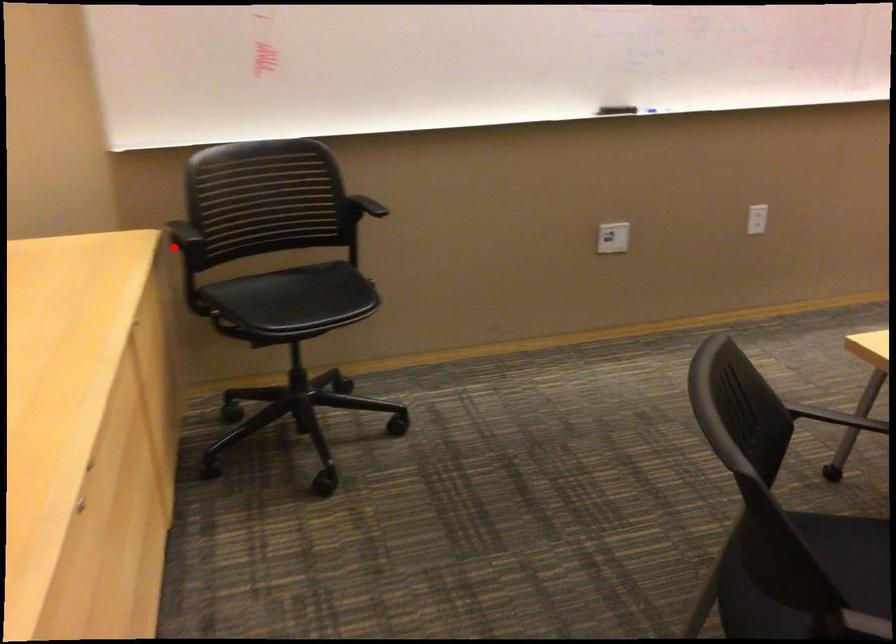
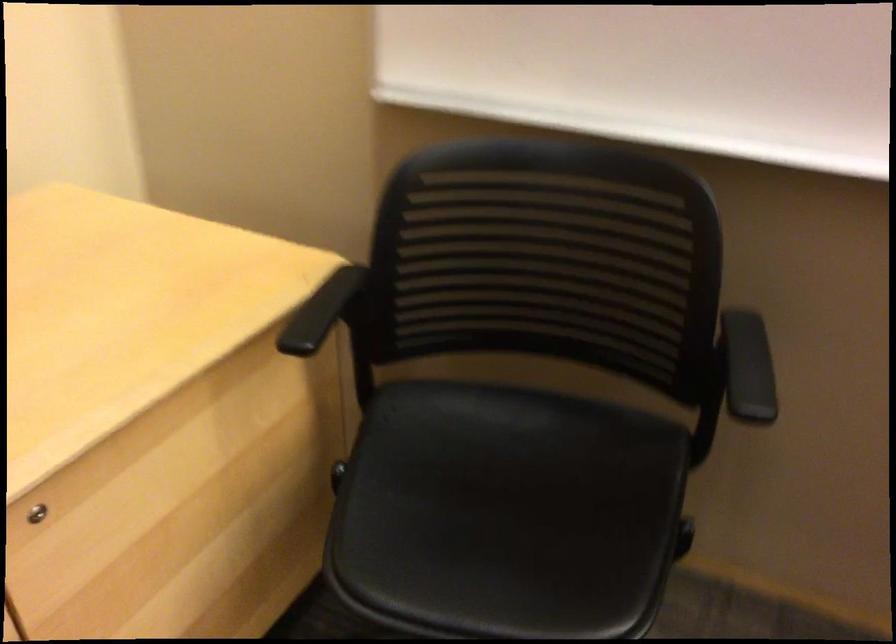
The point at the highlighted location is marked in the first image. Where is the corresponding point in the second image?

(322, 310)